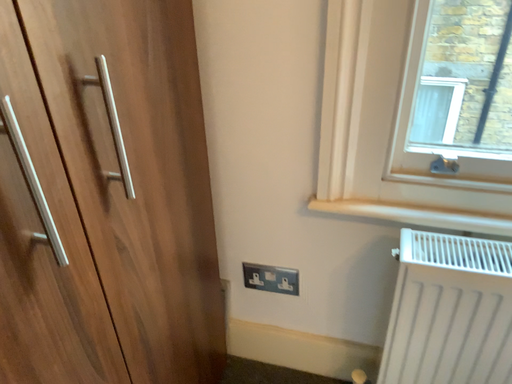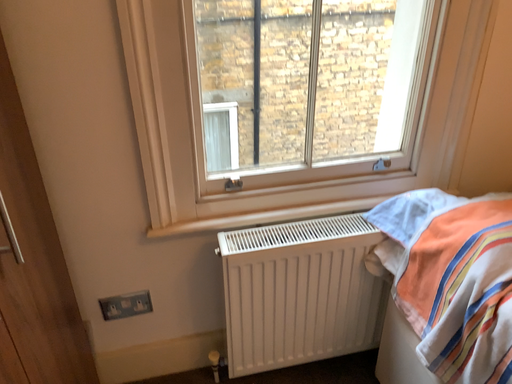
Question: Which way did the camera rotate in the video?

Choices:
 (A) rotated right
 (B) rotated left

Answer: (A)